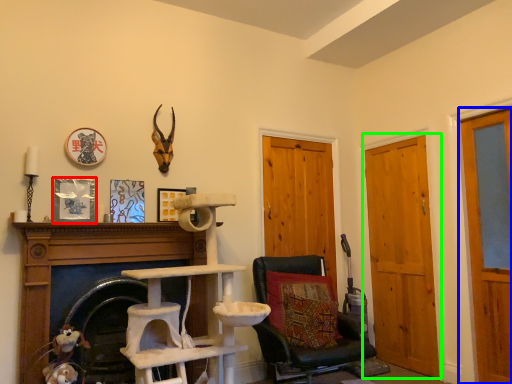
Question: Estimate the real-world distances between objects in this image. Which object is farther from picture frame (highlighted by a red box), door (highlighted by a blue box) or door (highlighted by a green box)?

Choices:
 (A) door
 (B) door

Answer: (A)